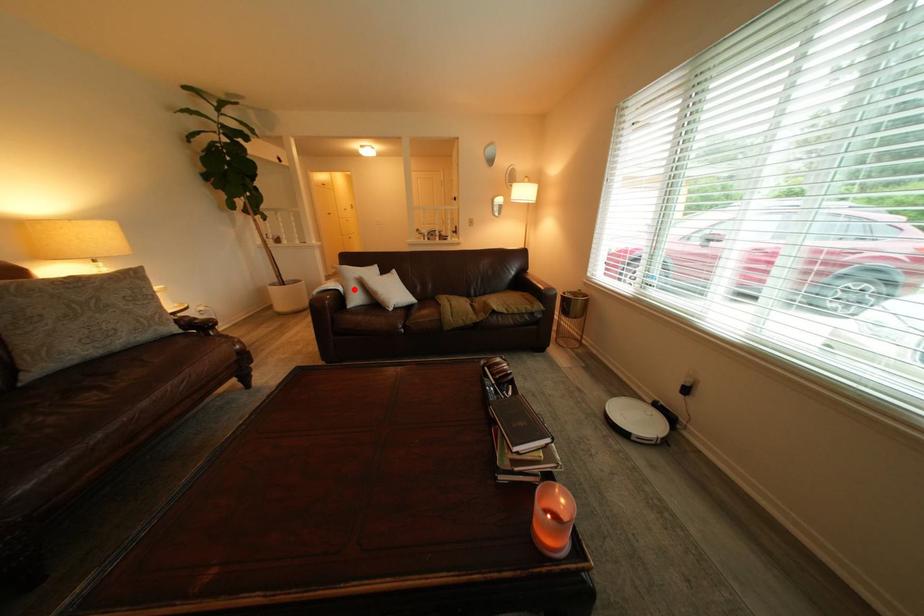
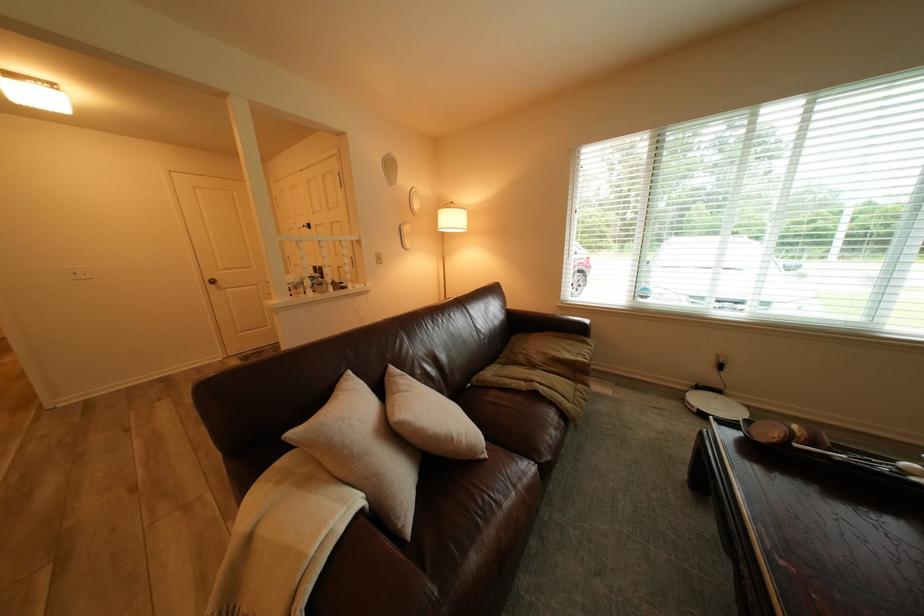
Find the pixel in the second image that matches the highlighted location in the first image.

(372, 500)